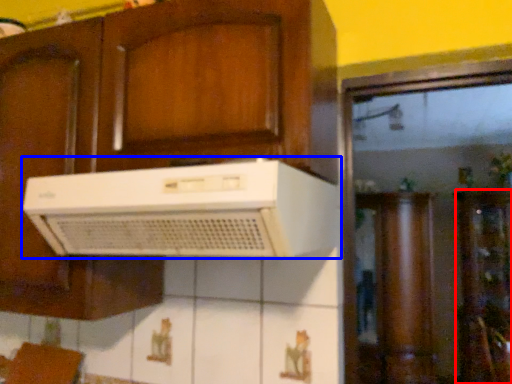
Question: Which of the following is the farthest to the observer, cabinetry (highlighted by a red box) or home appliance (highlighted by a blue box)?

Choices:
 (A) cabinetry
 (B) home appliance

Answer: (A)